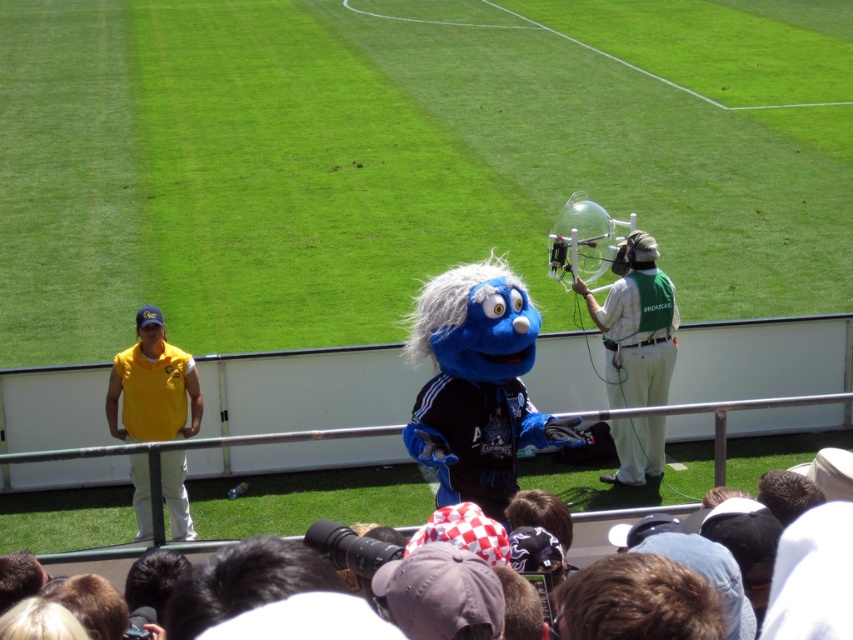
Question: Does green fabric microphone at right appear over yellow fabric shirt at left?

Choices:
 (A) no
 (B) yes

Answer: (B)

Question: Does green fabric microphone at right lie behind yellow fabric shirt at left?

Choices:
 (A) yes
 (B) no

Answer: (A)

Question: Which of the following is the closest to the observer?

Choices:
 (A) green fabric microphone at right
 (B) yellow fabric shirt at left

Answer: (B)

Question: Does green fabric microphone at right have a lesser width compared to yellow fabric shirt at left?

Choices:
 (A) yes
 (B) no

Answer: (B)